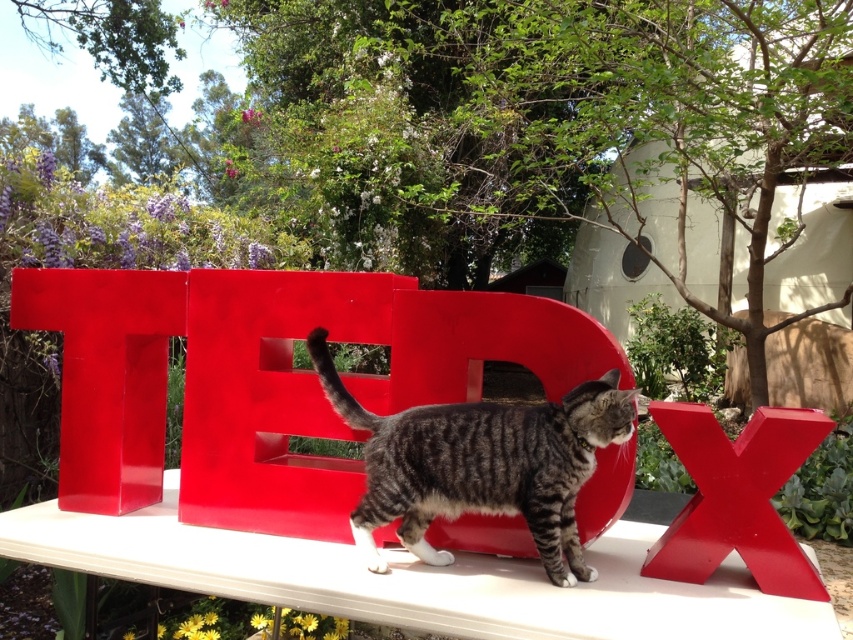
You are standing in front of the TEDx sign and want to take a photo of the tabby cat walking on it. Your camera has a focal length of 50mm and you want to ensure the cat is in focus. The cat is at point (579, 573). What is the minimum distance you need to be from the sign to capture the cat clearly?

The distance of point (579, 573) from the camera is 1.73 meters. To ensure the cat is in focus, you need to be at least 1.73 meters away from the sign.